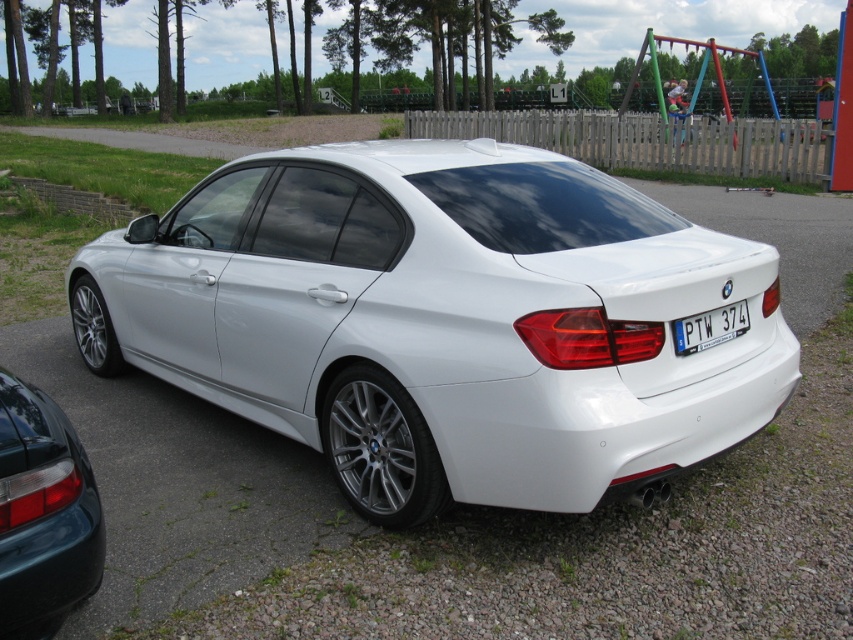
Question: Estimate the real-world distances between objects in this image. Which object is farther from the brick at lower left?

Choices:
 (A) white glossy sedan at center
 (B) white glossy car at center
 (C) teal glossy taillight at lower left
 (D) white plastic license plate at rear

Answer: (D)

Question: Can you confirm if white glossy car at center is bigger than brick at lower left?

Choices:
 (A) no
 (B) yes

Answer: (B)

Question: Which point appears closest to the camera in this image?

Choices:
 (A) (122, 360)
 (B) (42, 458)

Answer: (B)

Question: Which of the following is the closest to the observer?

Choices:
 (A) (59, 531)
 (B) (730, 316)

Answer: (A)

Question: Can you confirm if teal glossy taillight at lower left is smaller than white plastic license plate at rear?

Choices:
 (A) no
 (B) yes

Answer: (A)

Question: Does white glossy sedan at center appear on the left side of white glossy car at center?

Choices:
 (A) yes
 (B) no

Answer: (A)